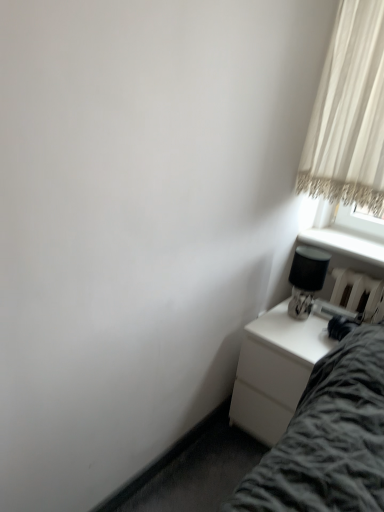
The height and width of the screenshot is (512, 384). What are the coordinates of `vacant space in front of black glossy table lamp at right` in the screenshot? It's located at pos(293,332).